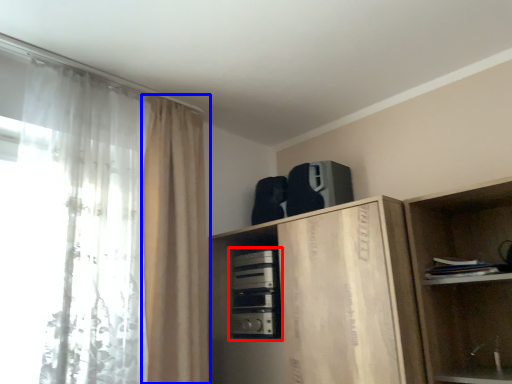
Question: Which object is closer to the camera taking this photo, appliance (highlighted by a red box) or curtain (highlighted by a blue box)?

Choices:
 (A) appliance
 (B) curtain

Answer: (B)